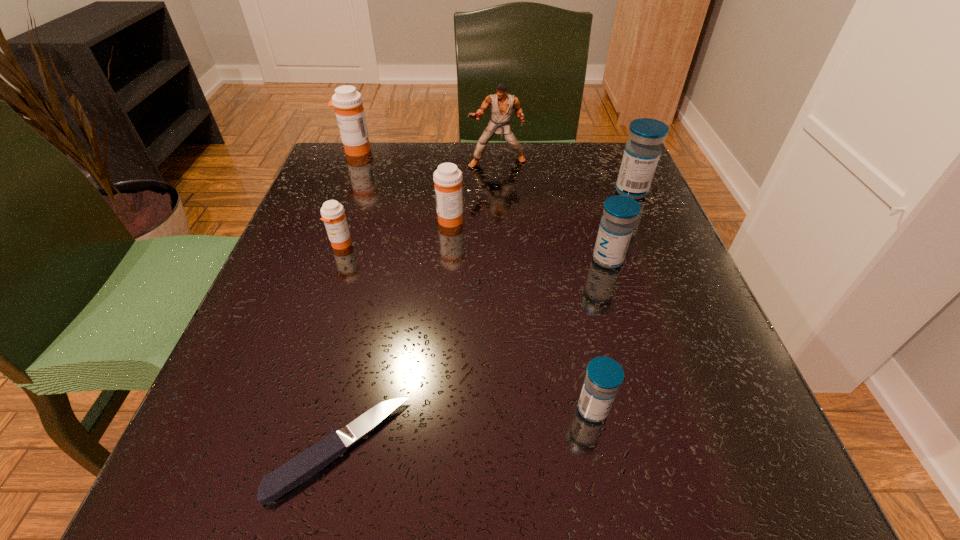
What are the coordinates of `free region at the left edge of the desktop` in the screenshot? It's located at (313, 285).

You are a GUI agent. You are given a task and a screenshot of the screen. Output one action in this format:
    pyautogui.click(x=<x>, y=<y>)
    Task: Click on the free space at the right edge
    The width and height of the screenshot is (960, 540).
    Given the screenshot: What is the action you would take?
    pyautogui.click(x=650, y=256)

This screenshot has height=540, width=960. Identify the location of vacant region at the far left corner of the desktop. (339, 172).

In the image, there is a desktop. Where is `vacant space at the far right corner`? Image resolution: width=960 pixels, height=540 pixels. vacant space at the far right corner is located at coordinates 642,198.

At what (x,y) coordinates should I click in order to perform the action: click on empty space between the fourth nearest medicine and the nearest medicine. Please return your answer as a coordinate pair (x, y). Looking at the image, I should click on (x=521, y=314).

Image resolution: width=960 pixels, height=540 pixels. Identify the location of vacant space that's between the rightmost orange medicine and the smallest orange medicine. (396, 232).

At what (x,y) coordinates should I click in order to perform the action: click on free space between the smallest blue medicine and the fourth object from right to left. Please return your answer as a coordinate pair (x, y). Looking at the image, I should click on (545, 286).

What are the coordinates of `vacant space that's between the farthest orange medicine and the nearest blue medicine` in the screenshot? It's located at (474, 280).

I want to click on empty space between the steak knife and the second biggest blue medicine, so pyautogui.click(x=474, y=354).

The image size is (960, 540). What are the coordinates of `free space between the smallest orange medicine and the shortest object` in the screenshot? It's located at (341, 347).